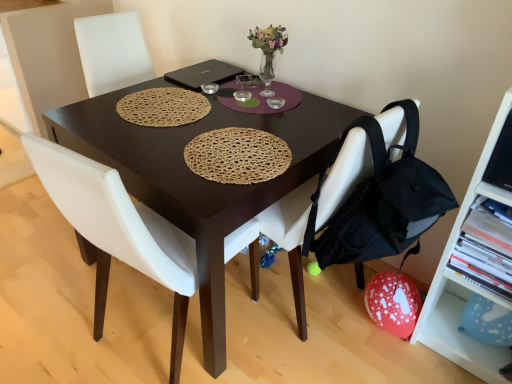
Measure the distance between point (x=456, y=330) and camera.

A distance of 1.66 meters exists between point (x=456, y=330) and camera.

I want to click on white plastic chair at center, marked as the 2th chair in a right-to-left arrangement, so (118, 230).

In order to face white plastic shelf at right, the 2th shelf ordered from the bottom, should I rotate leftwards or rightwards?

Turn right approximately 31.941 degrees to face it.

The height and width of the screenshot is (384, 512). Find the location of `black matte laptop at center`. black matte laptop at center is located at coordinates (204, 74).

Which is more to the left, black matte laptop at center or white plastic shelf at right, the 2th shelf ordered from the bottom?

black matte laptop at center.

Based on the photo, which object is thinner, black matte laptop at center or white plastic shelf at right, the 2th shelf ordered from the bottom?

white plastic shelf at right, the 2th shelf ordered from the bottom, is thinner.

Is black matte laptop at center far from white plastic shelf at right, the 2th shelf ordered from the bottom?

Absolutely, black matte laptop at center is distant from white plastic shelf at right, the 2th shelf ordered from the bottom.

Based on the photo, from a real-world perspective, who is located lower, black matte laptop at center or white plastic shelf at right, the second shelf in the top-to-bottom sequence?

From a 3D spatial view, white plastic shelf at right, the second shelf in the top-to-bottom sequence, is below.

Is blue paper balloon at lower right, the 1th shelf ordered from the bottom, located within black fabric backpack at lower right?

No, black fabric backpack at lower right does not contain blue paper balloon at lower right, the 1th shelf ordered from the bottom.

Looking at the image, does black fabric backpack at lower right seem bigger or smaller compared to blue paper balloon at lower right, which is counted as the 3th shelf, starting from the top?

Considering their sizes, black fabric backpack at lower right takes up more space than blue paper balloon at lower right, which is counted as the 3th shelf, starting from the top.

Considering the positions of points (428, 201) and (457, 355), is point (428, 201) farther from camera compared to point (457, 355)?

No, it is in front of (457, 355).

From the image's perspective, which object appears higher, black fabric backpack at lower right or blue paper balloon at lower right, which is counted as the 3th shelf, starting from the top?

black fabric backpack at lower right, from the image's perspective.

Which object is positioned more to the left, white fabric chair at center, positioned as the second chair in left-to-right order, or blue paper balloon at lower right, the 1th shelf ordered from the bottom?

white fabric chair at center, positioned as the second chair in left-to-right order, is more to the left.

Is white fabric chair at center, positioned as the second chair in left-to-right order, far away from blue paper balloon at lower right, the 1th shelf ordered from the bottom?

No.

Considering the positions of points (298, 191) and (500, 361), is point (298, 191) closer to camera compared to point (500, 361)?

No.

Considering the positions of objects white plastic shelf at right, the third shelf when ordered from bottom to top, and white fabric chair at center, which is counted as the first chair, starting from the right, in the image provided, who is more to the left, white plastic shelf at right, the third shelf when ordered from bottom to top, or white fabric chair at center, which is counted as the first chair, starting from the right,?

Positioned to the left is white fabric chair at center, which is counted as the first chair, starting from the right.

From the image's perspective, does white plastic shelf at right, the first shelf viewed from the top, appear higher than white fabric chair at center, which is counted as the first chair, starting from the right?

Incorrect, from the image's perspective, white plastic shelf at right, the first shelf viewed from the top, is lower than white fabric chair at center, which is counted as the first chair, starting from the right.

Who is smaller, white plastic shelf at right, the first shelf viewed from the top, or white fabric chair at center, which is counted as the first chair, starting from the right?

Smaller between the two is white plastic shelf at right, the first shelf viewed from the top.

Which is behind, white plastic shelf at right, the third shelf when ordered from bottom to top, or white fabric chair at center, positioned as the second chair in left-to-right order?

white plastic shelf at right, the third shelf when ordered from bottom to top, is further from the camera.

Is white plastic shelf at right, the first shelf viewed from the top, directly adjacent to translucent glass vase at upper center?

white plastic shelf at right, the first shelf viewed from the top, and translucent glass vase at upper center are clearly separated.

How many degrees apart are the facing directions of white plastic shelf at right, the third shelf when ordered from bottom to top, and translucent glass vase at upper center?

There is a 2.31-degree angle between the facing directions of white plastic shelf at right, the third shelf when ordered from bottom to top, and translucent glass vase at upper center.

From the image's perspective, is white plastic shelf at right, the third shelf when ordered from bottom to top, beneath translucent glass vase at upper center?

Indeed, from the image's perspective, white plastic shelf at right, the third shelf when ordered from bottom to top, is shown beneath translucent glass vase at upper center.

Can you tell me how much translucent glass vase at upper center and blue paper balloon at lower right, the 1th shelf ordered from the bottom, differ in facing direction?

They differ by 4.93 degrees in their facing directions.

Is translucent glass vase at upper center wider or thinner than blue paper balloon at lower right, which is counted as the 3th shelf, starting from the top?

In the image, translucent glass vase at upper center appears to be wider than blue paper balloon at lower right, which is counted as the 3th shelf, starting from the top.

From a real-world perspective, relative to blue paper balloon at lower right, the 1th shelf ordered from the bottom, is translucent glass vase at upper center vertically above or below?

From a real-world perspective, translucent glass vase at upper center is physically above blue paper balloon at lower right, the 1th shelf ordered from the bottom.

Is there a large distance between translucent glass vase at upper center and blue paper balloon at lower right, which is counted as the 3th shelf, starting from the top?

translucent glass vase at upper center is positioned a significant distance from blue paper balloon at lower right, which is counted as the 3th shelf, starting from the top.

Looking at this image, does white plastic shelf at right, the second shelf in the top-to-bottom sequence, turn towards translucent glass vase at upper center?

No, white plastic shelf at right, the second shelf in the top-to-bottom sequence, does not turn towards translucent glass vase at upper center.

In the scene shown: From a real-world perspective, is white plastic shelf at right, the 2th shelf ordered from the bottom, on translucent glass vase at upper center?

Incorrect, from a real-world perspective, white plastic shelf at right, the 2th shelf ordered from the bottom, is lower than translucent glass vase at upper center.

Is white plastic shelf at right, the 2th shelf ordered from the bottom, not within translucent glass vase at upper center?

That's correct, white plastic shelf at right, the 2th shelf ordered from the bottom, is outside of translucent glass vase at upper center.

From the image's perspective, which is below, white plastic shelf at right, the 2th shelf ordered from the bottom, or translucent glass vase at upper center?

From the image's view, white plastic shelf at right, the 2th shelf ordered from the bottom, is below.

You are a GUI agent. You are given a task and a screenshot of the screen. Output one action in this format:
    pyautogui.click(x=<x>, y=<y>)
    Task: Click on the shelf that is the 2nd object to the right of the black matte laptop at center, starting at the anchor
    The image size is (512, 384).
    Given the screenshot: What is the action you would take?
    pyautogui.click(x=462, y=290)

The image size is (512, 384). What are the coordinates of `handbag on the left of blue paper balloon at lower right, the 1th shelf ordered from the bottom` in the screenshot? It's located at (380, 200).

Estimate the real-world distances between objects in this image. Which object is further from white fabric chair at center, which is counted as the first chair, starting from the right, dark brown wooden desk at center or translucent glass vase at upper center?

translucent glass vase at upper center.

Looking at the image, which one is located closer to white plastic shelf at right, the third shelf when ordered from bottom to top, white plastic shelf at right, the 2th shelf ordered from the bottom, or black matte laptop at center?

white plastic shelf at right, the 2th shelf ordered from the bottom, is positioned closer to the anchor white plastic shelf at right, the third shelf when ordered from bottom to top.

Considering their positions, is white plastic chair at center, marked as the 2th chair in a right-to-left arrangement, positioned closer to white fabric chair at center, which is counted as the first chair, starting from the right, than dark brown wooden desk at center?

Among the two, dark brown wooden desk at center is located nearer to white fabric chair at center, which is counted as the first chair, starting from the right.

Estimate the real-world distances between objects in this image. Which object is closer to white plastic shelf at right, the third shelf when ordered from bottom to top, white plastic chair at center, marked as the 2th chair in a right-to-left arrangement, or blue paper balloon at lower right, the 1th shelf ordered from the bottom?

blue paper balloon at lower right, the 1th shelf ordered from the bottom.

From the image, which object appears to be farther from white plastic shelf at right, the second shelf in the top-to-bottom sequence, white plastic shelf at right, the third shelf when ordered from bottom to top, or black matte laptop at center?

black matte laptop at center is positioned further to the anchor white plastic shelf at right, the second shelf in the top-to-bottom sequence.

Estimate the real-world distances between objects in this image. Which object is further from white plastic chair at center, acting as the 1th chair starting from the left, white plastic shelf at right, the first shelf viewed from the top, or dark brown wooden desk at center?

white plastic shelf at right, the first shelf viewed from the top, lies further to white plastic chair at center, acting as the 1th chair starting from the left, than the other object.

Estimate the real-world distances between objects in this image. Which object is closer to blue paper balloon at lower right, which is counted as the 3th shelf, starting from the top, white plastic chair at center, marked as the 2th chair in a right-to-left arrangement, or dark brown wooden desk at center?

dark brown wooden desk at center lies closer to blue paper balloon at lower right, which is counted as the 3th shelf, starting from the top, than the other object.

Estimate the real-world distances between objects in this image. Which object is further from white plastic shelf at right, the third shelf when ordered from bottom to top, white plastic shelf at right, the second shelf in the top-to-bottom sequence, or blue paper balloon at lower right, which is counted as the 3th shelf, starting from the top?

Based on the image, blue paper balloon at lower right, which is counted as the 3th shelf, starting from the top, appears to be further to white plastic shelf at right, the third shelf when ordered from bottom to top.

This screenshot has height=384, width=512. I want to click on floral arrangement situated between dark brown wooden desk at center and white plastic shelf at right, the 2th shelf ordered from the bottom, from left to right, so click(268, 52).

Where is `handbag located between white plastic chair at center, acting as the 1th chair starting from the left, and blue paper balloon at lower right, which is counted as the 3th shelf, starting from the top, in the left-right direction`? The height and width of the screenshot is (384, 512). handbag located between white plastic chair at center, acting as the 1th chair starting from the left, and blue paper balloon at lower right, which is counted as the 3th shelf, starting from the top, in the left-right direction is located at coordinates (380, 200).

At what (x,y) coordinates should I click in order to perform the action: click on shelf between dark brown wooden desk at center and white plastic shelf at right, the second shelf in the top-to-bottom sequence. Please return your answer as a coordinate pair (x, y). Looking at the image, I should click on (484, 251).

Where is `handbag between white plastic chair at center, acting as the 1th chair starting from the left, and black matte laptop at center from front to back`? handbag between white plastic chair at center, acting as the 1th chair starting from the left, and black matte laptop at center from front to back is located at coordinates (380, 200).